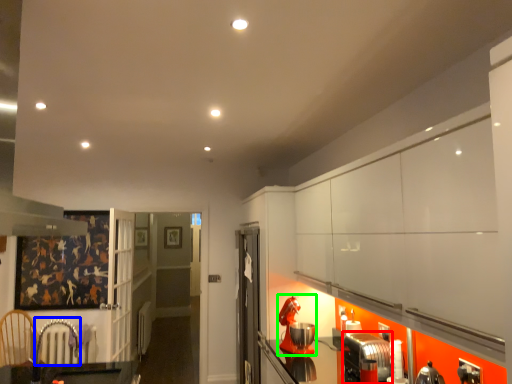
Question: Based on their relative distances, which object is nearer to appliance (highlighted by a red box)? Choose from armchair (highlighted by a blue box) and appliance (highlighted by a green box).

Choices:
 (A) armchair
 (B) appliance

Answer: (B)